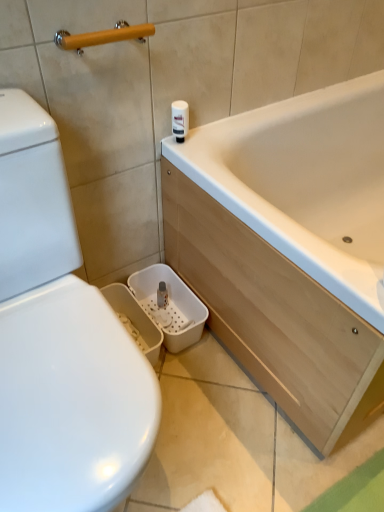
Question: Can you confirm if white glossy toilet paper at upper center is smaller than wooden handle at upper left?

Choices:
 (A) yes
 (B) no

Answer: (A)

Question: Is white glossy toilet paper at upper center turned away from wooden handle at upper left?

Choices:
 (A) no
 (B) yes

Answer: (A)

Question: Is white glossy toilet paper at upper center taller than wooden handle at upper left?

Choices:
 (A) yes
 (B) no

Answer: (A)

Question: Is white glossy toilet paper at upper center bigger than wooden handle at upper left?

Choices:
 (A) no
 (B) yes

Answer: (A)

Question: Does white glossy toilet paper at upper center turn towards wooden handle at upper left?

Choices:
 (A) yes
 (B) no

Answer: (B)

Question: From a real-world perspective, is white glossy toilet paper at upper center over wooden handle at upper left?

Choices:
 (A) no
 (B) yes

Answer: (A)

Question: Can you confirm if wooden handle at upper left is smaller than white glossy toilet paper at upper center?

Choices:
 (A) no
 (B) yes

Answer: (A)

Question: Is wooden handle at upper left placed right next to white glossy toilet paper at upper center?

Choices:
 (A) yes
 (B) no

Answer: (B)

Question: From the image's perspective, is wooden handle at upper left below white glossy toilet paper at upper center?

Choices:
 (A) yes
 (B) no

Answer: (B)

Question: Can you confirm if wooden handle at upper left is bigger than white glossy toilet paper at upper center?

Choices:
 (A) yes
 (B) no

Answer: (A)

Question: Does wooden handle at upper left come behind white glossy toilet paper at upper center?

Choices:
 (A) yes
 (B) no

Answer: (B)

Question: Could white glossy toilet paper at upper center be considered to be inside wooden handle at upper left?

Choices:
 (A) no
 (B) yes

Answer: (A)

Question: Considering the relative positions of wooden handle at upper left and white glossy toilet paper at upper center in the image provided, is wooden handle at upper left to the left or to the right of white glossy toilet paper at upper center?

Choices:
 (A) right
 (B) left

Answer: (B)